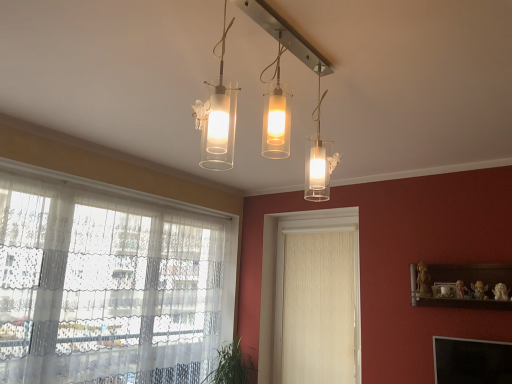
Question: Does transparent lace curtain at left lie behind white textured curtain at center?

Choices:
 (A) yes
 (B) no

Answer: (B)

Question: Is transparent lace curtain at left touching white textured curtain at center?

Choices:
 (A) yes
 (B) no

Answer: (B)

Question: Considering the relative positions of transparent lace curtain at left and white textured curtain at center in the image provided, is transparent lace curtain at left to the left of white textured curtain at center from the viewer's perspective?

Choices:
 (A) no
 (B) yes

Answer: (B)

Question: Considering the relative sizes of transparent lace curtain at left and white textured curtain at center in the image provided, is transparent lace curtain at left shorter than white textured curtain at center?

Choices:
 (A) no
 (B) yes

Answer: (A)

Question: Could white textured curtain at center be considered to be inside transparent lace curtain at left?

Choices:
 (A) no
 (B) yes

Answer: (A)

Question: Does transparent lace curtain at left lie in front of white textured curtain at center?

Choices:
 (A) no
 (B) yes

Answer: (B)

Question: Can you confirm if transparent lace curtain at left is bigger than green leafy plant at lower left?

Choices:
 (A) no
 (B) yes

Answer: (B)

Question: Is transparent lace curtain at left outside of green leafy plant at lower left?

Choices:
 (A) no
 (B) yes

Answer: (B)

Question: Does transparent lace curtain at left have a greater height compared to green leafy plant at lower left?

Choices:
 (A) yes
 (B) no

Answer: (A)

Question: From the image's perspective, is transparent lace curtain at left under green leafy plant at lower left?

Choices:
 (A) yes
 (B) no

Answer: (B)

Question: Is transparent lace curtain at left thinner than green leafy plant at lower left?

Choices:
 (A) yes
 (B) no

Answer: (A)

Question: Can you confirm if transparent lace curtain at left is smaller than green leafy plant at lower left?

Choices:
 (A) no
 (B) yes

Answer: (A)

Question: Is green leafy plant at lower left in front of clear glass light fixture at center?

Choices:
 (A) no
 (B) yes

Answer: (A)